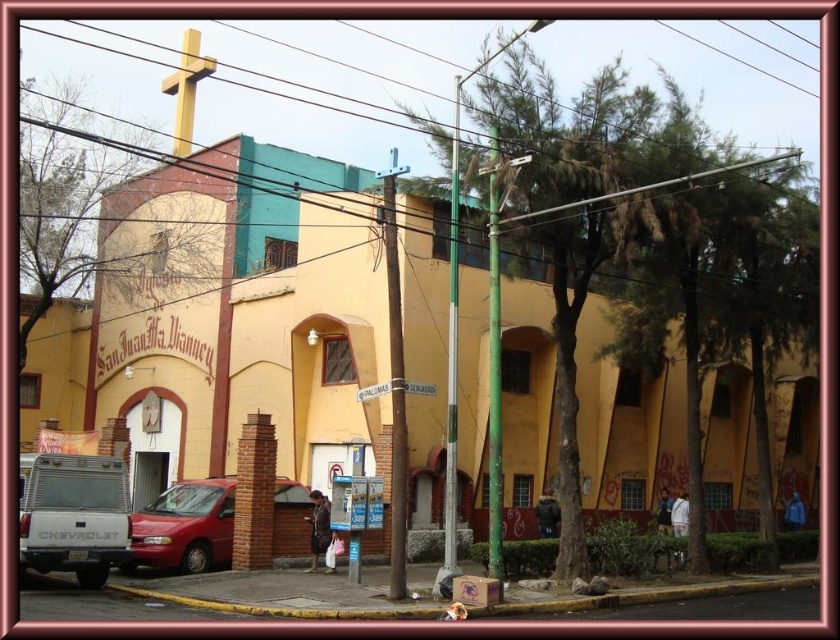
You are standing in front of the church and notice two points marked on the ground. The first point is at coordinate point (118, 528) and the second is at point (187, 28). Which point is closer to you?

Point (118, 528) is closer to the viewer than point (187, 28).

You are a photographer standing at the corner of the street. You want to take a photo of the yellow matte building at center and the metallic red van at lower left. Which object will appear larger in the photo?

The yellow matte building at center will appear larger in the photo because it is much taller than the metallic red van at lower left.